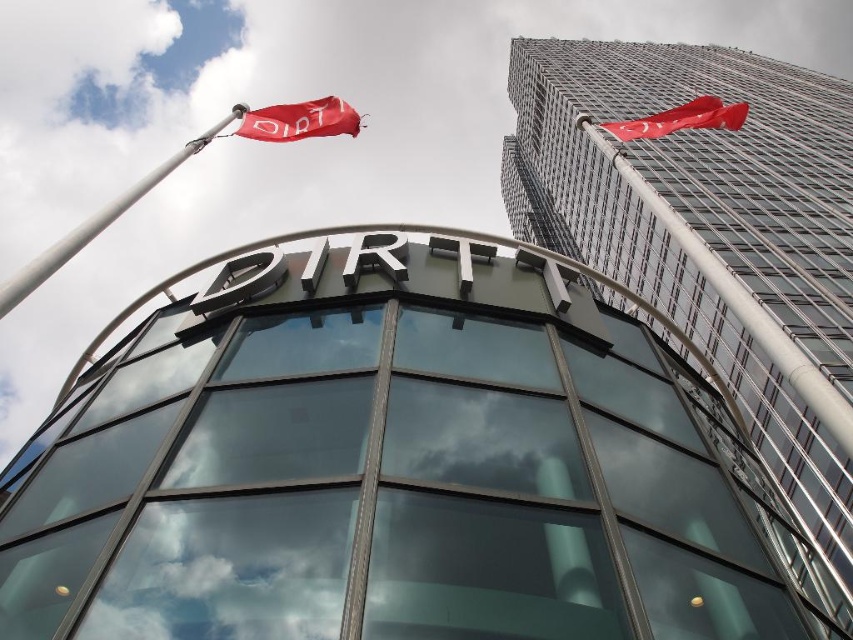
Question: Which object is positioned closest to the red fabric flag at upper right?

Choices:
 (A) silver metallic flag pole at upper left
 (B) red fabric flag at upper left

Answer: (B)

Question: Is red fabric flag at upper left to the left of red fabric flag at upper right from the viewer's perspective?

Choices:
 (A) no
 (B) yes

Answer: (B)

Question: Estimate the real-world distances between objects in this image. Which object is closer to the red fabric flag at upper left?

Choices:
 (A) red fabric flag at upper right
 (B) silver metallic flag pole at upper left

Answer: (A)

Question: Does silver metallic flag pole at upper left appear on the left side of red fabric flag at upper right?

Choices:
 (A) yes
 (B) no

Answer: (A)

Question: Can you confirm if red fabric flag at upper left is bigger than red fabric flag at upper right?

Choices:
 (A) yes
 (B) no

Answer: (B)

Question: Which point is farther from the camera taking this photo?

Choices:
 (A) (273, 140)
 (B) (669, 120)

Answer: (A)